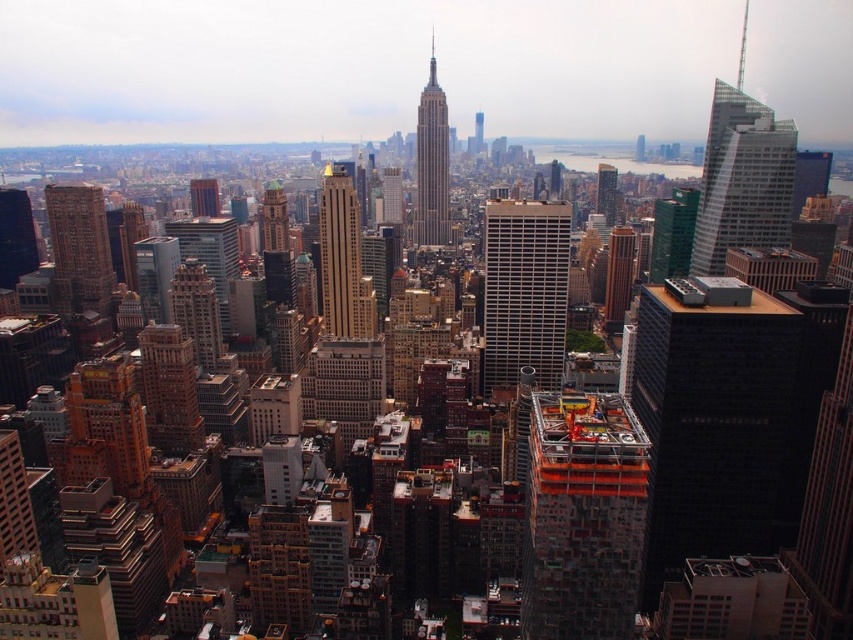
You are a drone operator trying to deliver a package to the glassy reflective skyscraper at upper right. The delivery zone is marked by point coordinates. Can you confirm if the point at coordinates (741, 179) is the correct location for delivery?

Yes, the point at coordinates (741, 179) marks the glassy reflective skyscraper at upper right, so it is the correct location for delivery.